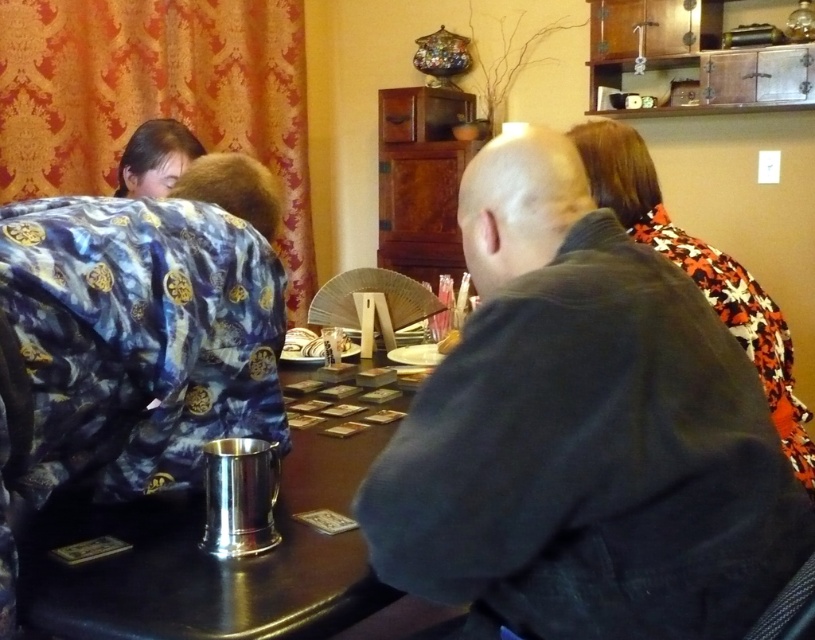
You are standing at the entrance of the room and want to hand a drink to the person wearing the dark gray jacket at center. Which direction should you move to reach them?

The dark gray jacket at center is located at point (584, 433), so you should move towards the center of the room to reach them.

You are sitting at the wooden table and want to hand a card to the person with the dark gray jacket at center and the person with smooth brown hair at upper left. Which one can you reach without moving your chair?

The dark gray jacket at center is closer to the viewer than smooth brown hair at upper left, so you can reach the person with the dark gray jacket at center without moving your chair.